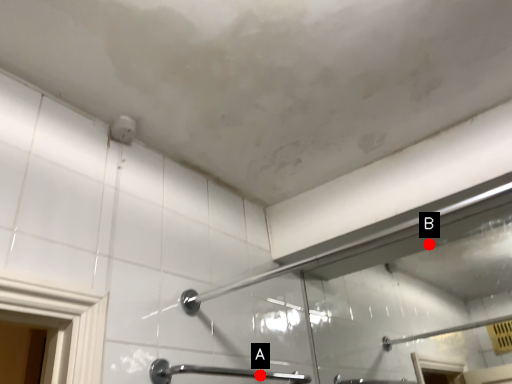
Question: Two points are circled on the image, labeled by A and B beside each circle. Which point is further to the camera?

Choices:
 (A) A is further
 (B) B is further

Answer: (B)